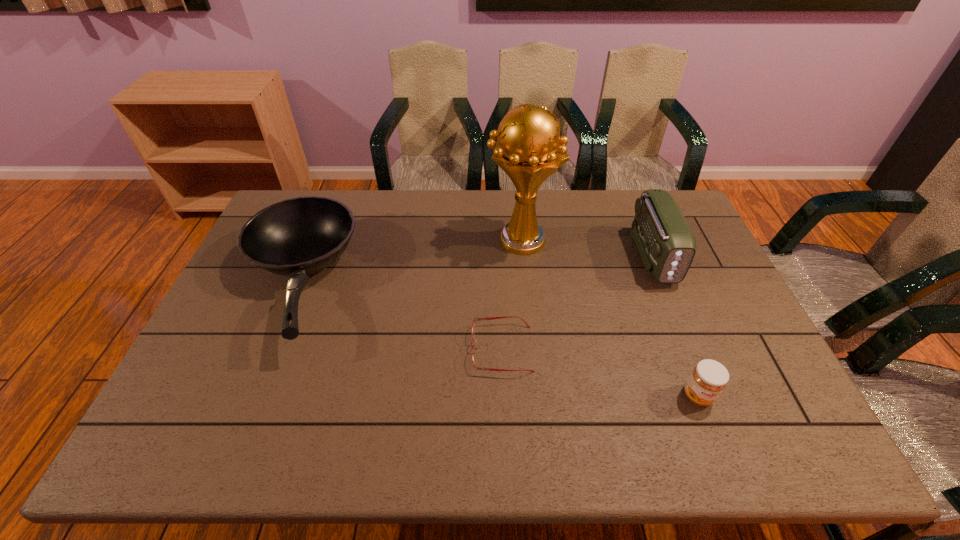
Where is `free spot located 0.320m on the front-facing side of the radio_receiver`? The width and height of the screenshot is (960, 540). free spot located 0.320m on the front-facing side of the radio_receiver is located at coordinates (705, 381).

Locate an element on the screen. The width and height of the screenshot is (960, 540). vacant region located on the front of the leftmost object is located at coordinates (258, 381).

Identify the location of free space located 0.100m on the front label of the jam. This screenshot has width=960, height=540. (719, 452).

The width and height of the screenshot is (960, 540). What are the coordinates of `free region located on the lenses of the shortest object` in the screenshot? It's located at [335, 349].

You are a GUI agent. You are given a task and a screenshot of the screen. Output one action in this format:
    pyautogui.click(x=<x>, y=<y>)
    Task: Click on the vacant space situated on the lenses of the shortest object
    This screenshot has width=960, height=540.
    Given the screenshot: What is the action you would take?
    pyautogui.click(x=415, y=349)

This screenshot has height=540, width=960. In order to click on free space located 0.360m on the lenses of the shortest object in this screenshot , I will do `click(335, 349)`.

Image resolution: width=960 pixels, height=540 pixels. In order to click on trophy_cup at the far edge in this screenshot , I will do `click(529, 149)`.

The image size is (960, 540). Identify the location of radio_receiver at the far edge. (666, 243).

Identify the location of frying pan that is positioned at the far edge. This screenshot has width=960, height=540. (296, 237).

Find the location of `object positioned at the left edge`. object positioned at the left edge is located at coordinates (296, 237).